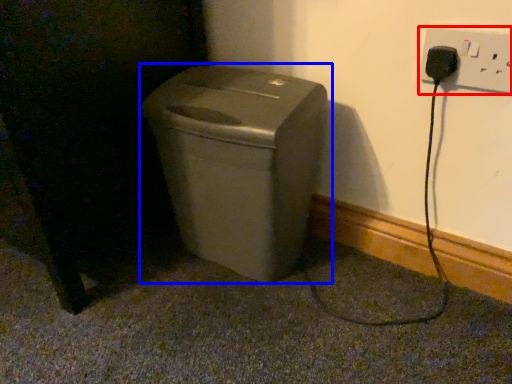
Question: Which of the following is the closest to the observer, electric outlet (highlighted by a red box) or waste container (highlighted by a blue box)?

Choices:
 (A) electric outlet
 (B) waste container

Answer: (A)